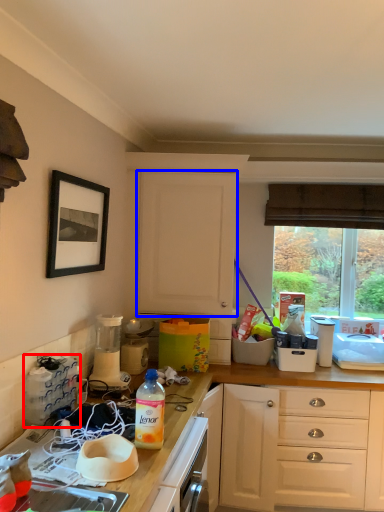
Question: Which object is closer to the camera taking this photo, appliance (highlighted by a red box) or cabinetry (highlighted by a blue box)?

Choices:
 (A) appliance
 (B) cabinetry

Answer: (A)